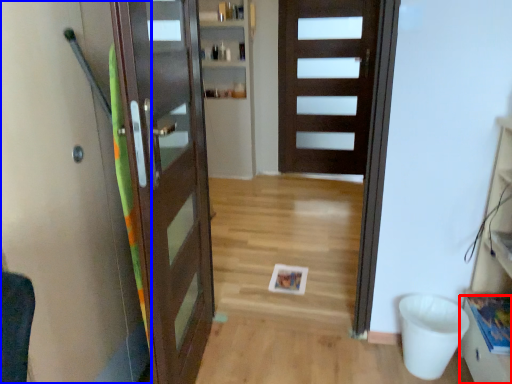
Question: Among these objects, which one is nearest to the camera, drawer (highlighted by a red box) or elevator (highlighted by a blue box)?

Choices:
 (A) drawer
 (B) elevator

Answer: (B)